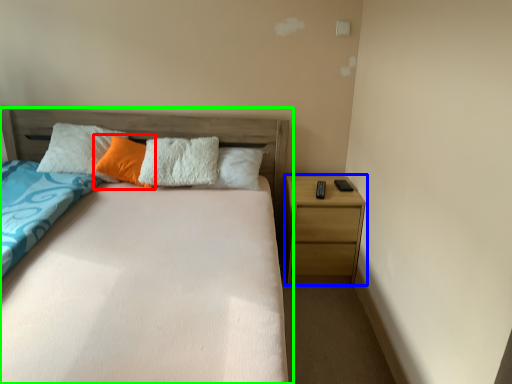
Question: Which is nearer to the pillow (highlighted by a red box)? nightstand (highlighted by a blue box) or bed (highlighted by a green box).

Choices:
 (A) nightstand
 (B) bed

Answer: (B)